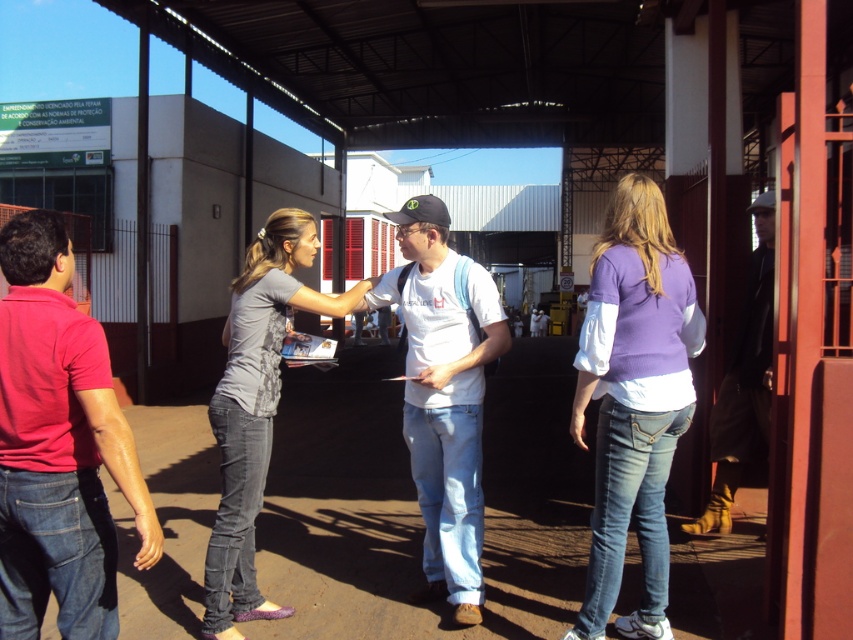
Which is below, purple knit sweater at center or white cotton t-shirt at center?

white cotton t-shirt at center

Between point (614, 282) and point (450, 540), which one is positioned behind?

The point (450, 540) is behind.

This screenshot has width=853, height=640. Identify the location of purple knit sweater at center. (633, 397).

Between white cotton t-shirt at center and gray cotton shirt at center, which one is positioned lower?

gray cotton shirt at center

Is white cotton t-shirt at center to the left of gray cotton shirt at center from the viewer's perspective?

In fact, white cotton t-shirt at center is to the right of gray cotton shirt at center.

Does point (450, 321) lie in front of point (268, 448)?

No, (450, 321) is further to viewer.

At what (x,y) coordinates should I click in order to perform the action: click on white cotton t-shirt at center. Please return your answer as a coordinate pair (x, y). The width and height of the screenshot is (853, 640). Looking at the image, I should click on (444, 394).

Who is more distant from viewer, (88, 579) or (434, 209)?

Positioned behind is point (434, 209).

Looking at this image, does matte red shirt at left have a greater height compared to white cotton t-shirt at center?

No, matte red shirt at left is not taller than white cotton t-shirt at center.

What do you see at coordinates (57, 445) in the screenshot? I see `matte red shirt at left` at bounding box center [57, 445].

Locate an element on the screen. Image resolution: width=853 pixels, height=640 pixels. matte red shirt at left is located at coordinates (57, 445).